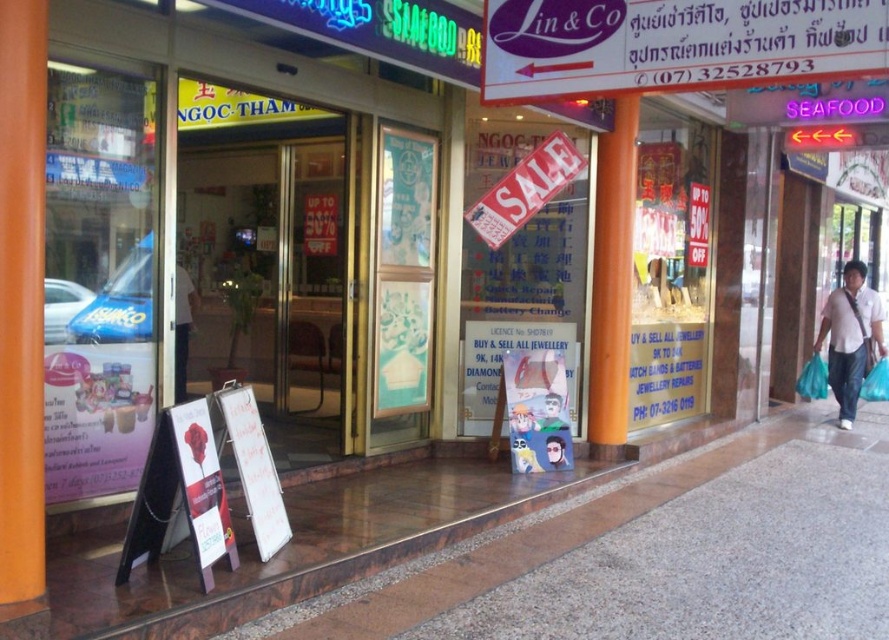
Between brown polished stone pavement at lower center and metallic silver helmet at center, which one has less height?

brown polished stone pavement at lower center is shorter.

How much distance is there between brown polished stone pavement at lower center and metallic silver helmet at center?

4.70 feet

You are a GUI agent. You are given a task and a screenshot of the screen. Output one action in this format:
    pyautogui.click(x=<x>, y=<y>)
    Task: Click on the brown polished stone pavement at lower center
    The width and height of the screenshot is (889, 640).
    Given the screenshot: What is the action you would take?
    pyautogui.click(x=655, y=554)

Is orange matte pillar at center to the right of metallic silver helmet at center from the viewer's perspective?

Indeed, orange matte pillar at center is positioned on the right side of metallic silver helmet at center.

Which is in front, point (623, 387) or point (561, 448)?

Positioned in front is point (561, 448).

Where is `orange matte pillar at center`? The height and width of the screenshot is (640, 889). orange matte pillar at center is located at coordinates (611, 282).

Who is positioned more to the right, orange matte pillar at center or white cotton shirt at right?

white cotton shirt at right

Is point (626, 376) in front of point (866, 365)?

Yes.

Image resolution: width=889 pixels, height=640 pixels. I want to click on orange matte pillar at center, so click(x=611, y=282).